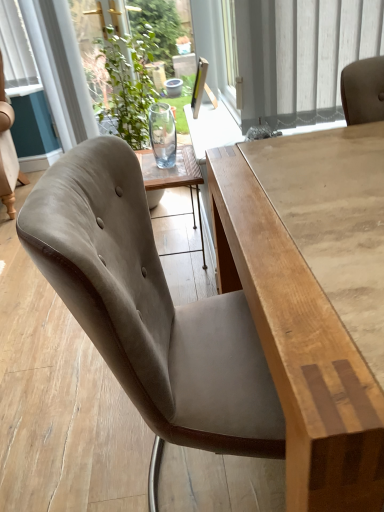
Question: In terms of width, does suede-like beige chair at center look wider or thinner when compared to light brown wood table at center?

Choices:
 (A) thin
 (B) wide

Answer: (B)

Question: Is suede-like beige chair at center bigger or smaller than light brown wood table at center?

Choices:
 (A) small
 (B) big

Answer: (A)

Question: Estimate the real-world distances between objects in this image. Which object is closer to the light brown wood table at center?

Choices:
 (A) transparent glass vase at upper center
 (B) suede-like beige chair at center

Answer: (B)

Question: Which object is the closest to the transparent glass vase at upper center?

Choices:
 (A) suede-like beige chair at center
 (B) light brown wood table at center

Answer: (B)